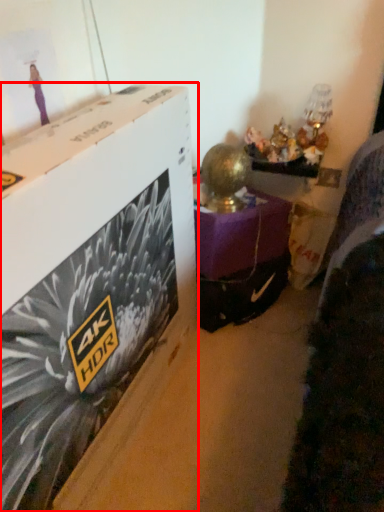
Question: Observing the image, what is the correct spatial positioning of box (annotated by the red box) in reference to furniture?

Choices:
 (A) right
 (B) left

Answer: (B)